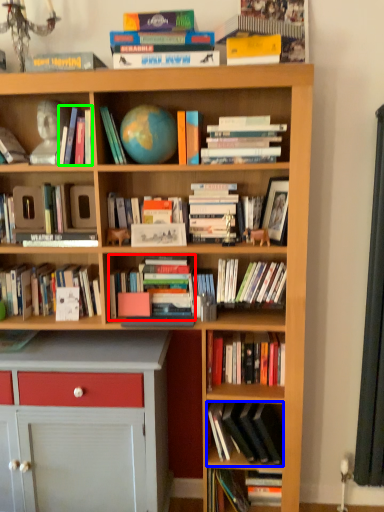
Question: Considering the real-world distances, which object is farthest from book (highlighted by a red box)? book (highlighted by a blue box) or book (highlighted by a green box)?

Choices:
 (A) book
 (B) book

Answer: (B)